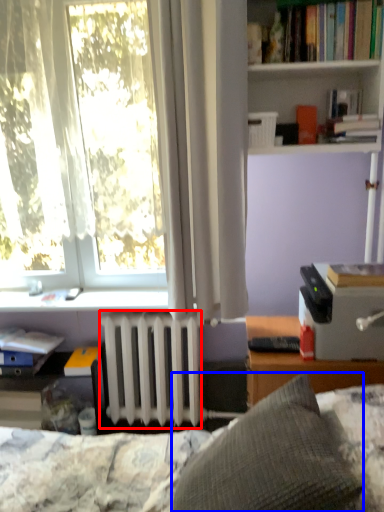
Question: Among these objects, which one is nearest to the camera, radiator (highlighted by a red box) or pillow (highlighted by a blue box)?

Choices:
 (A) radiator
 (B) pillow

Answer: (B)